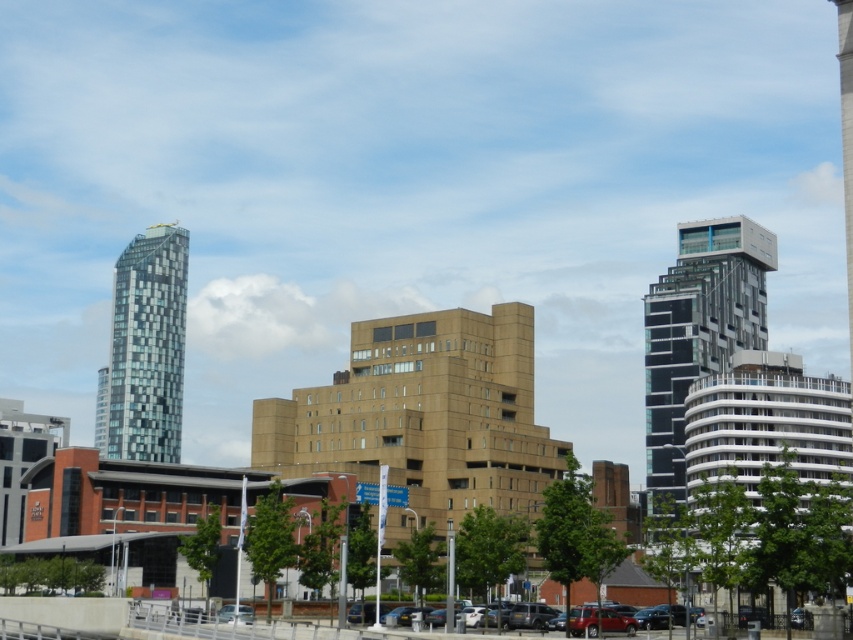
Question: Which point is farther to the camera?

Choices:
 (A) (692, 300)
 (B) (184, 301)
 (C) (689, 625)

Answer: (B)

Question: Which object is positioned farthest from the metallic silver car at lower center?

Choices:
 (A) brown concrete building at center
 (B) black glass tower at right

Answer: (B)

Question: Is black glass tower at right to the right of matte red car at lower center from the viewer's perspective?

Choices:
 (A) no
 (B) yes

Answer: (B)

Question: Can you confirm if brown concrete building at center is positioned below glass mosaic tower at left?

Choices:
 (A) no
 (B) yes

Answer: (A)

Question: Does black glass tower at right appear under metallic silver car at lower center?

Choices:
 (A) no
 (B) yes

Answer: (A)

Question: Which point is closer to the camera taking this photo?

Choices:
 (A) (297, 440)
 (B) (215, 616)
 (C) (612, 609)

Answer: (B)